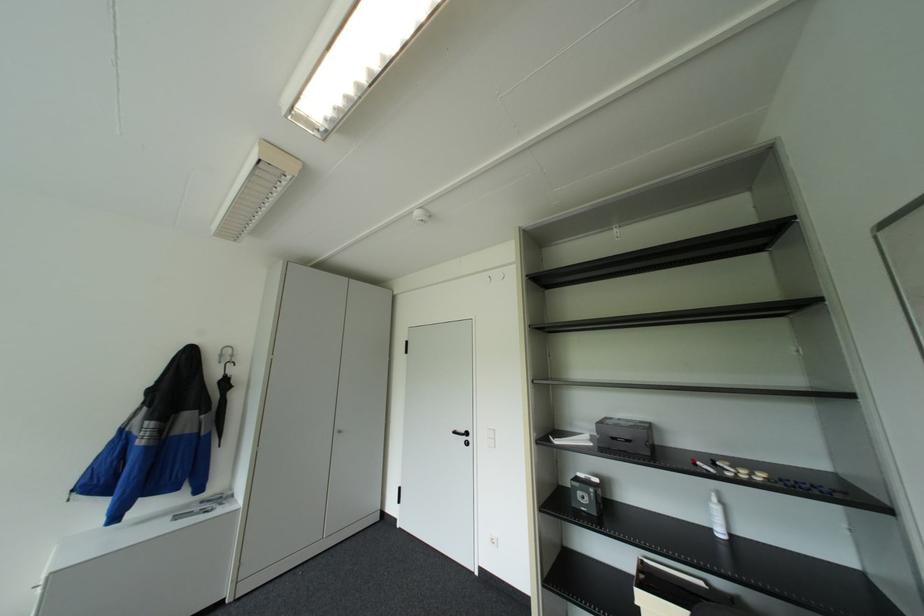
You are a GUI agent. You are given a task and a screenshot of the screen. Output one action in this format:
    pyautogui.click(x=<x>, y=<y>)
    Task: Click on the white spray bottle
    Image resolution: width=924 pixels, height=616 pixels.
    Given the screenshot: What is the action you would take?
    pyautogui.click(x=718, y=516)